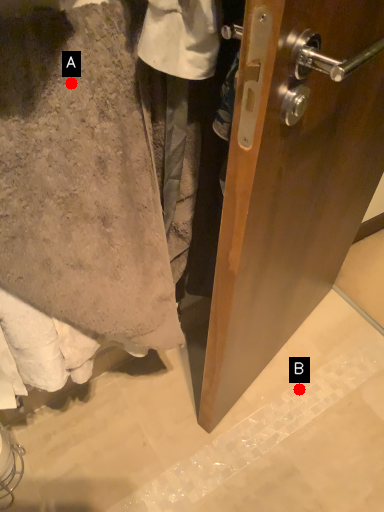
Question: Two points are circled on the image, labeled by A and B beside each circle. Which point appears closest to the camera in this image?

Choices:
 (A) A is closer
 (B) B is closer

Answer: (A)